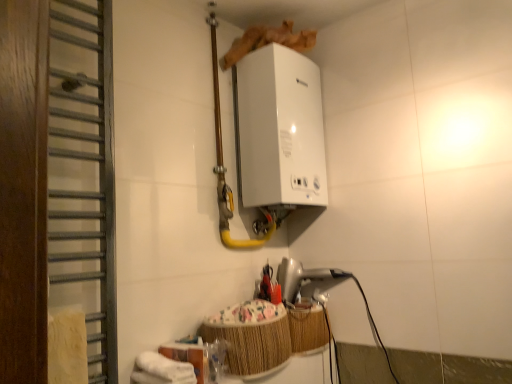
Question: Does point (222, 233) appear closer or farther from the camera than point (60, 124)?

Choices:
 (A) farther
 (B) closer

Answer: (A)

Question: Is white glossy pipe at upper center inside or outside of wooden towel rack at left?

Choices:
 (A) outside
 (B) inside

Answer: (A)

Question: Estimate the real-world distances between objects in this image. Which object is closer to the white glossy pipe at upper center?

Choices:
 (A) wooden towel rack at left
 (B) woven bamboo basket at lower center
 (C) white glossy boiler at upper center, the 2th appliance when ordered from bottom to top
 (D) silver metallic hairdryer at lower center, which appears as the 2th appliance when viewed from the top

Answer: (C)

Question: Estimate the real-world distances between objects in this image. Which object is closer to the woven bamboo basket at lower center?

Choices:
 (A) wooden towel rack at left
 (B) white glossy pipe at upper center
 (C) white glossy boiler at upper center, the 2th appliance when ordered from bottom to top
 (D) silver metallic hairdryer at lower center, which appears as the 2th appliance when viewed from the top

Answer: (D)